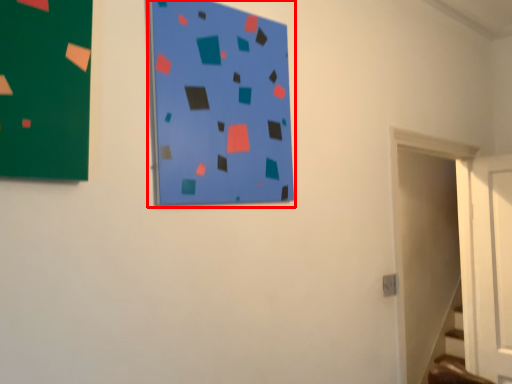
Question: From the image's perspective, considering the relative positions of bulletin board (annotated by the red box) and door in the image provided, where is bulletin board (annotated by the red box) located with respect to the staircase?

Choices:
 (A) below
 (B) above

Answer: (B)